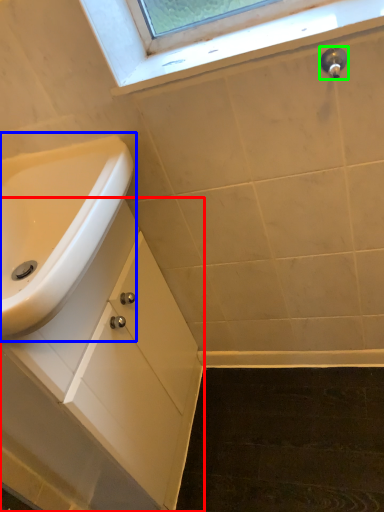
Question: Which is farther away from bathroom cabinet (highlighted by a red box)? sink (highlighted by a blue box) or plumbing fixture (highlighted by a green box)?

Choices:
 (A) sink
 (B) plumbing fixture

Answer: (B)